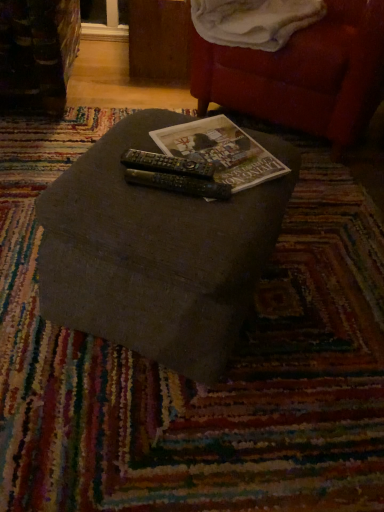
Locate an element on the screen. This screenshot has width=384, height=512. vacant area that is situated to the right of textured gray ottoman at center is located at coordinates (324, 296).